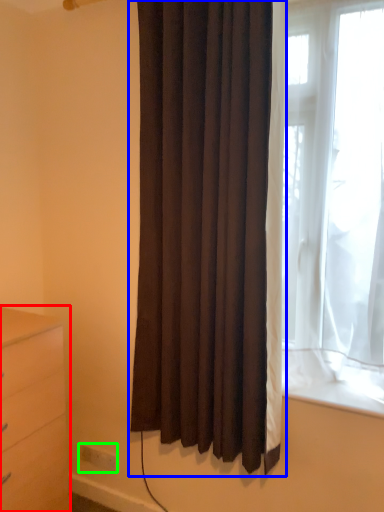
Question: Which object is the farthest from chest of drawers (highlighted by a red box)? Choose among these: curtain (highlighted by a blue box) or electric outlet (highlighted by a green box).

Choices:
 (A) curtain
 (B) electric outlet

Answer: (B)